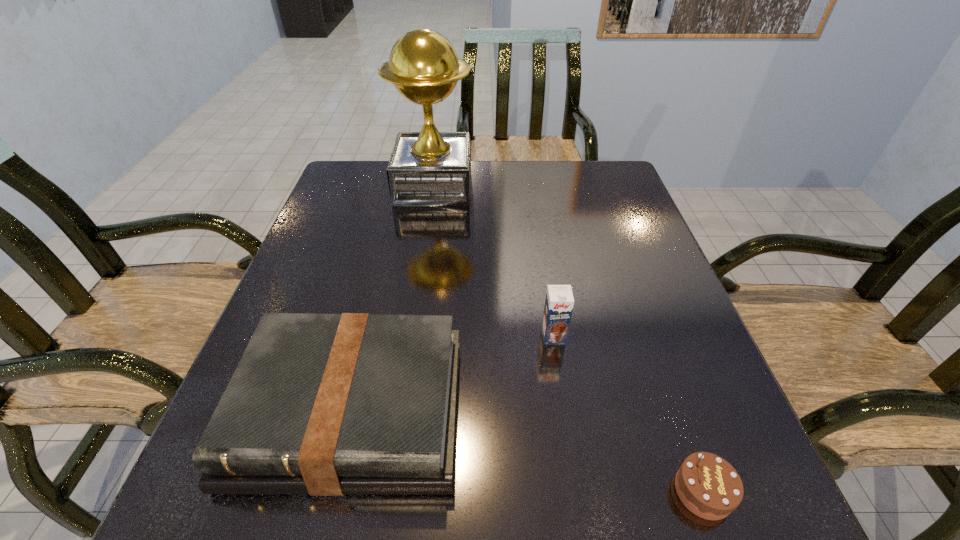
Identify the location of unoccupied area between the second tallest object and the tallest object. (493, 261).

Where is `unoccupied position between the tallest object and the hardback book`? This screenshot has width=960, height=540. unoccupied position between the tallest object and the hardback book is located at coordinates (393, 298).

The height and width of the screenshot is (540, 960). What are the coordinates of `the third closest object to the hardback book` in the screenshot? It's located at (429, 168).

In order to click on object that is the third closest to the third object from left to right in this screenshot , I will do `click(429, 168)`.

This screenshot has width=960, height=540. Identify the location of free space that satisfies the following two spatial constraints: 1. on the spine side of the chocolate cake; 2. on the right side of the third tallest object. (332, 491).

The width and height of the screenshot is (960, 540). What are the coordinates of `blank area in the image that satisfies the following two spatial constraints: 1. on the back side of the rightmost object; 2. on the front-facing side of the farthest object` in the screenshot? It's located at (594, 186).

Locate an element on the screen. This screenshot has height=540, width=960. free spot that satisfies the following two spatial constraints: 1. on the front label of the chocolate milk; 2. on the right side of the shortest object is located at coordinates (578, 491).

This screenshot has height=540, width=960. What are the coordinates of `vacant position in the image that satisfies the following two spatial constraints: 1. on the front-facing side of the rightmost object; 2. on the right side of the tallest object` in the screenshot? It's located at (390, 491).

Identify the location of vacant position in the image that satisfies the following two spatial constraints: 1. on the spine side of the chocolate cake; 2. on the right side of the hardback book. (332, 491).

Where is `free point that satisfies the following two spatial constraints: 1. on the front-facing side of the farthest object; 2. on the spine side of the hardback book`? The image size is (960, 540). free point that satisfies the following two spatial constraints: 1. on the front-facing side of the farthest object; 2. on the spine side of the hardback book is located at coordinates (401, 411).